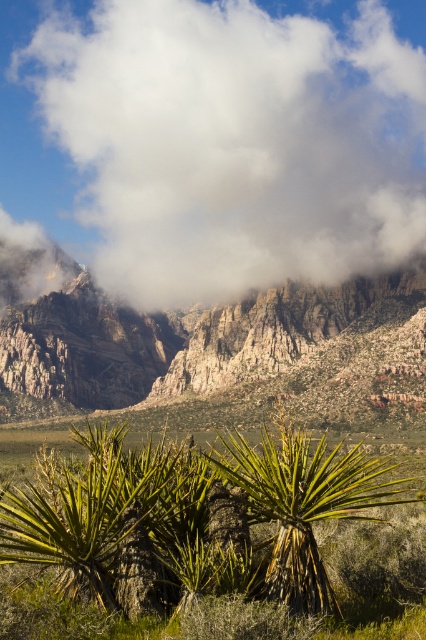
Between green leafy plant at center and rugged red rock formation at center, which one appears on the right side from the viewer's perspective?

From the viewer's perspective, green leafy plant at center appears more on the right side.

Based on the photo, which is below, green leafy plant at center or rugged red rock formation at center?

green leafy plant at center is below.

Which is in front, point (180, 550) or point (321, 337)?

Point (180, 550) is more forward.

The width and height of the screenshot is (426, 640). What are the coordinates of `green leafy plant at center` in the screenshot? It's located at (195, 525).

Is white fluffy cloud at upper center below rugged red rock formation at center?

Incorrect, white fluffy cloud at upper center is not positioned below rugged red rock formation at center.

Is point (293, 253) behind point (101, 385)?

No, it is not.

Where is `white fluffy cloud at upper center`? white fluffy cloud at upper center is located at coordinates (233, 141).

Can you confirm if rugged red rock formation at center is positioned below green leafy palm tree at center?

Incorrect, rugged red rock formation at center is not positioned below green leafy palm tree at center.

Can you confirm if rugged red rock formation at center is positioned to the right of green leafy palm tree at center?

Incorrect, rugged red rock formation at center is not on the right side of green leafy palm tree at center.

Between point (152, 369) and point (276, 541), which one is positioned in front?

Point (276, 541) is in front.

Locate an element on the screen. This screenshot has height=640, width=426. rugged red rock formation at center is located at coordinates (160, 333).